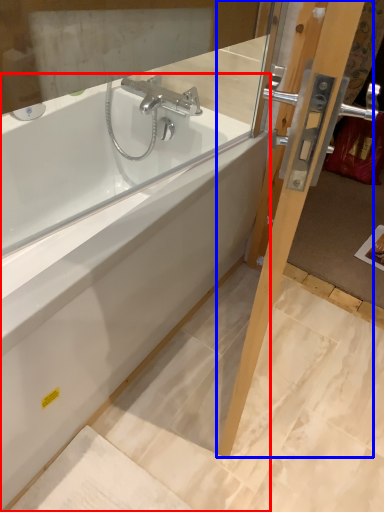
Question: Which point is further to the camera, bathtub (highlighted by a red box) or screen door (highlighted by a blue box)?

Choices:
 (A) bathtub
 (B) screen door

Answer: (A)